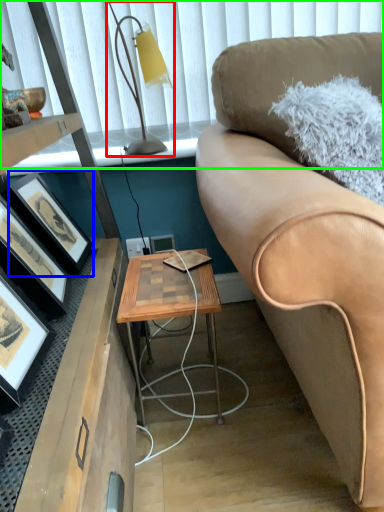
Question: Considering the real-world distances, which object is farthest from table lamp (highlighted by a red box)? picture frame (highlighted by a blue box) or window screen (highlighted by a green box)?

Choices:
 (A) picture frame
 (B) window screen

Answer: (A)